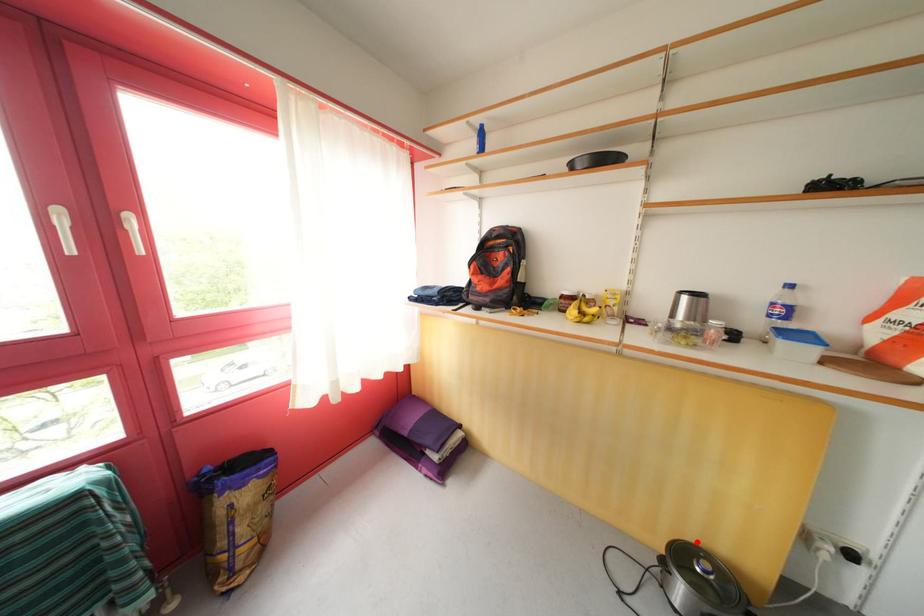
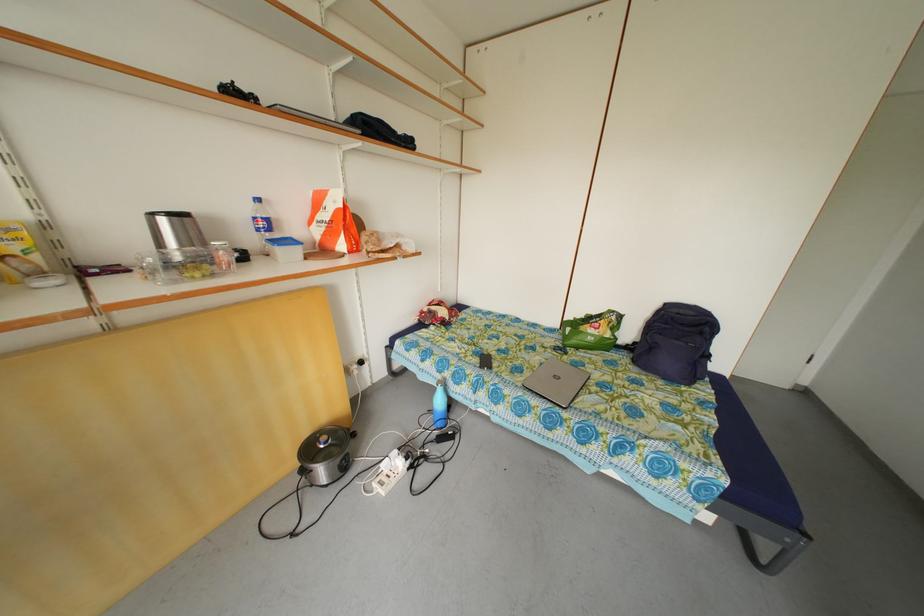
In the second image, find the point that corresponds to the highlighted location in the first image.

(313, 440)